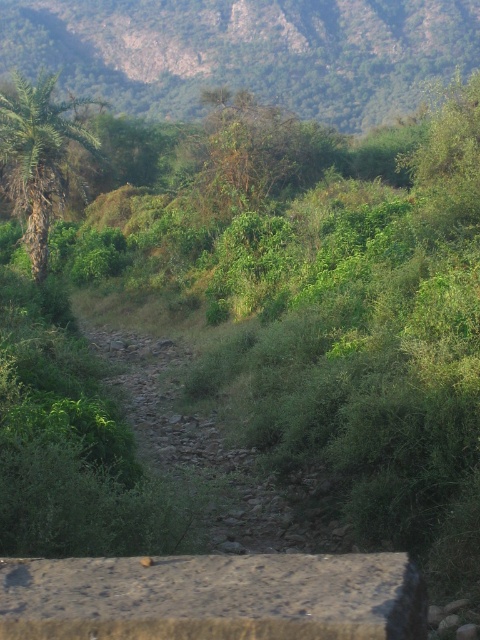
Question: Is green leafy hillside at upper center further to the viewer compared to green leafy palm at left?

Choices:
 (A) no
 (B) yes

Answer: (B)

Question: Which object is farther from the camera taking this photo?

Choices:
 (A) green leafy hillside at upper center
 (B) green leafy palm at left

Answer: (A)

Question: Is green leafy hillside at upper center positioned at the back of green leafy palm at left?

Choices:
 (A) yes
 (B) no

Answer: (A)

Question: Does green leafy hillside at upper center appear on the right side of green leafy palm at left?

Choices:
 (A) yes
 (B) no

Answer: (A)